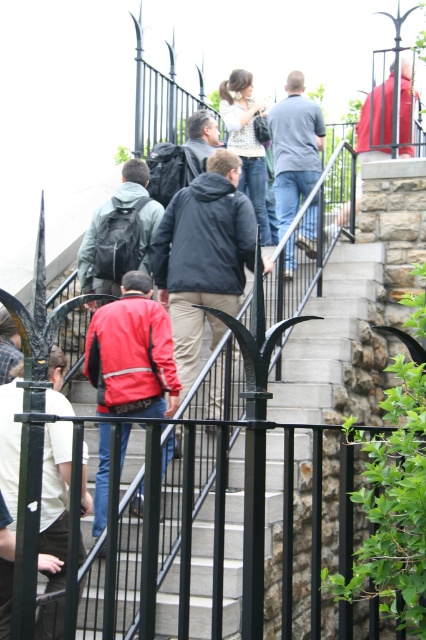
Which is in front, point (279, 150) or point (94, 301)?

Point (94, 301) is more forward.

Between point (316, 177) and point (149, 234), which one is positioned in front?

Positioned in front is point (149, 234).

Locate an element on the screen. The image size is (426, 640). gray cotton shirt at upper center is located at coordinates (294, 147).

Can you confirm if red jacket at lower left is taller than dark gray jacket at center?

Correct, red jacket at lower left is much taller as dark gray jacket at center.

Is red jacket at lower left to the right of dark gray jacket at center from the viewer's perspective?

No, red jacket at lower left is not to the right of dark gray jacket at center.

Describe the element at coordinates (54, 497) in the screenshot. I see `red jacket at lower left` at that location.

What are the coordinates of `red jacket at lower left` in the screenshot? It's located at (54, 497).

This screenshot has width=426, height=640. Describe the element at coordinates (203, 257) in the screenshot. I see `dark blue jacket at center` at that location.

Which is more to the right, dark blue jacket at center or red leather jacket at center?

dark blue jacket at center

What do you see at coordinates (203, 257) in the screenshot?
I see `dark blue jacket at center` at bounding box center [203, 257].

Identify the location of dark blue jacket at center. The height and width of the screenshot is (640, 426). (203, 257).